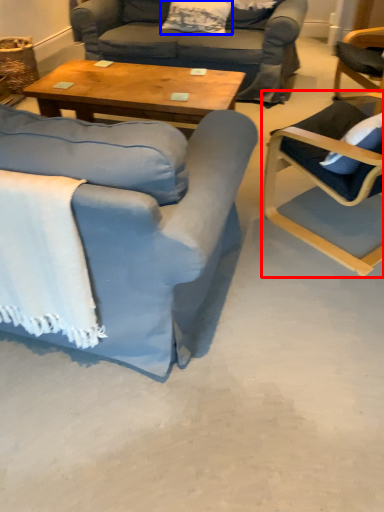
Question: Among these objects, which one is farthest to the camera, chair (highlighted by a red box) or pillow (highlighted by a blue box)?

Choices:
 (A) chair
 (B) pillow

Answer: (B)